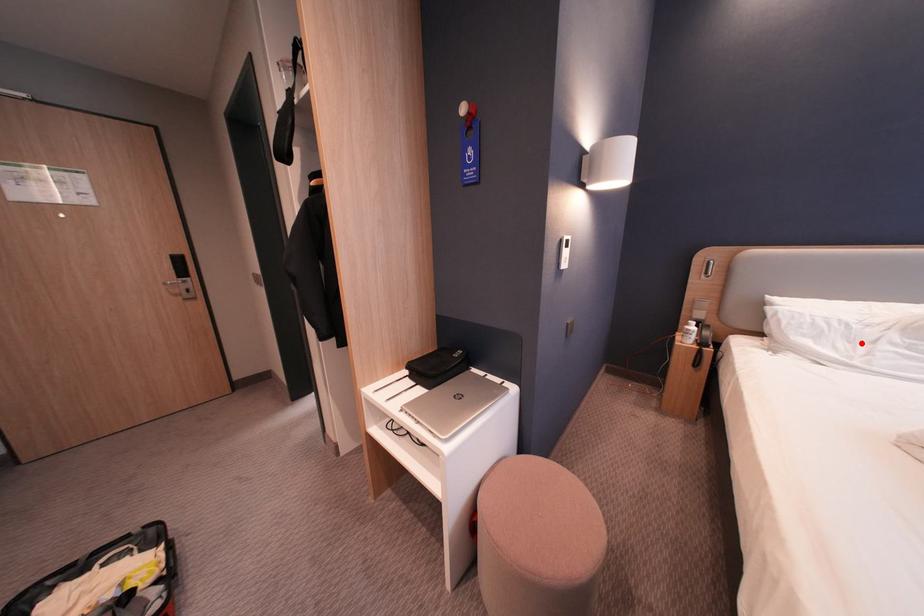
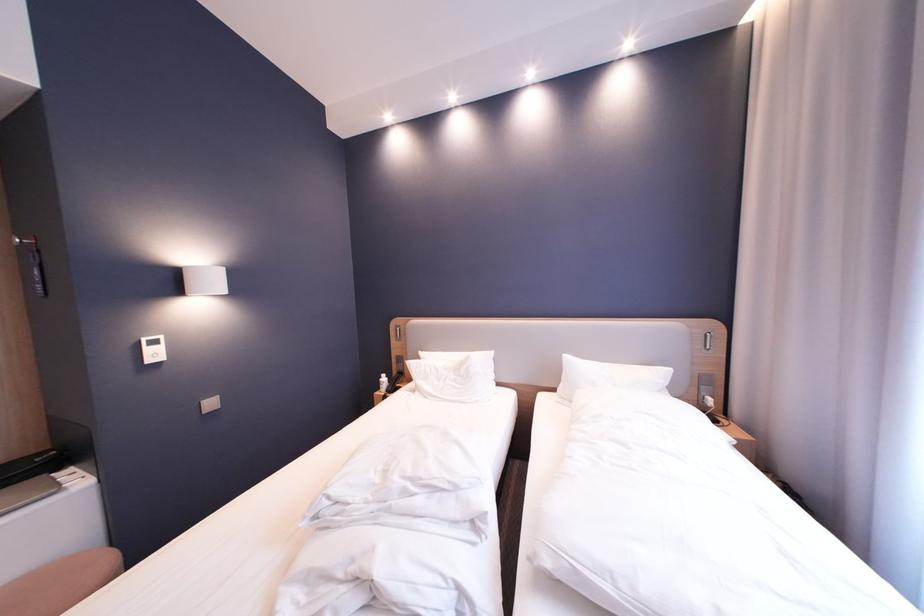
The point at the highlighted location is marked in the first image. Where is the corresponding point in the second image?

(450, 382)